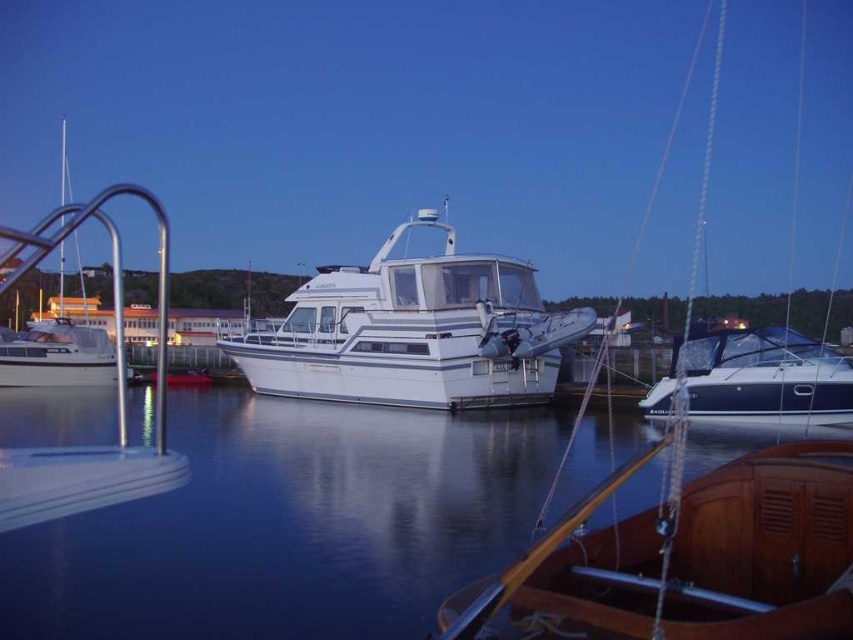
Question: Can you confirm if smooth water at center is positioned above white glossy boat at left?

Choices:
 (A) yes
 (B) no

Answer: (B)

Question: Is white glossy boat at center further to camera compared to white glossy boat at left?

Choices:
 (A) yes
 (B) no

Answer: (A)

Question: Which point is farther to the camera?

Choices:
 (A) smooth water at center
 (B) blue glossy sailboat at right
 (C) white glossy boat at left
 (D) white glossy boat at center

Answer: (D)

Question: Which of the following is the farthest from the observer?

Choices:
 (A) white glossy boat at center
 (B) white glossy boat at left

Answer: (A)

Question: Is smooth water at center smaller than white glossy boat at center?

Choices:
 (A) no
 (B) yes

Answer: (B)

Question: Considering the real-world distances, which object is farthest from the white glossy boat at center?

Choices:
 (A) blue glossy sailboat at right
 (B) smooth water at center

Answer: (A)